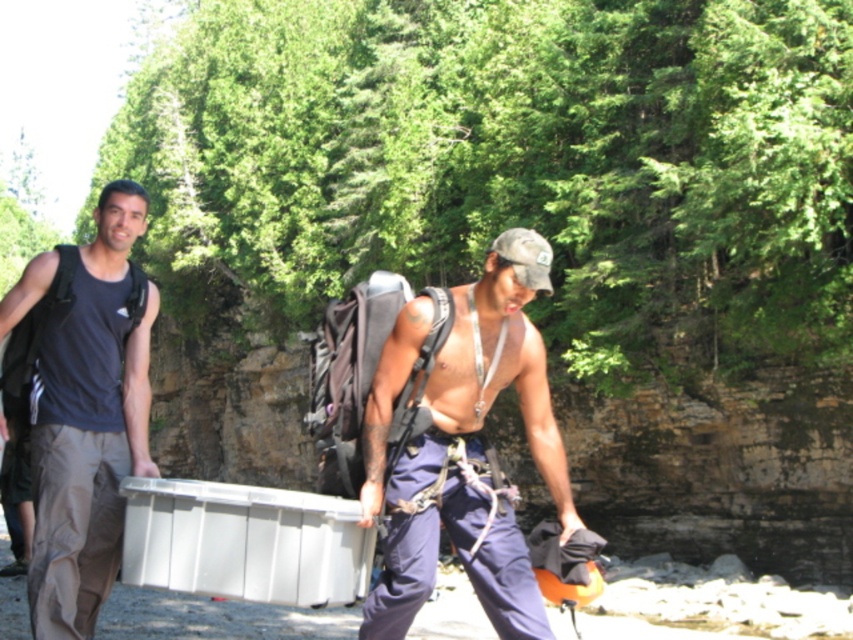
Between point (451, 340) and point (132, 289), which one is positioned behind?

The point (132, 289) is behind.

Who is positioned more to the left, shiny blue pants at center or matte gray tank top at left?

matte gray tank top at left is more to the left.

Is point (512, 369) positioned before point (78, 500)?

Yes, it is in front of point (78, 500).

This screenshot has width=853, height=640. Identify the location of shiny blue pants at center. (463, 448).